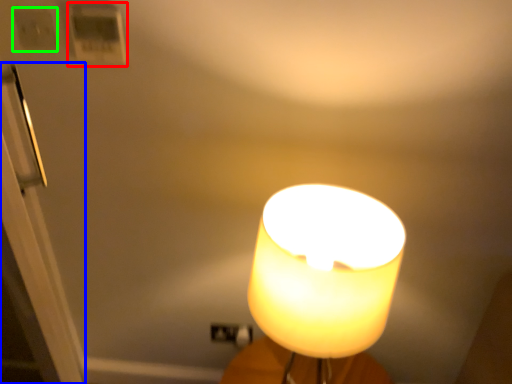
Question: Which is farther away from light switch (highlighted by a red box)? door (highlighted by a blue box) or light switch (highlighted by a green box)?

Choices:
 (A) door
 (B) light switch

Answer: (A)